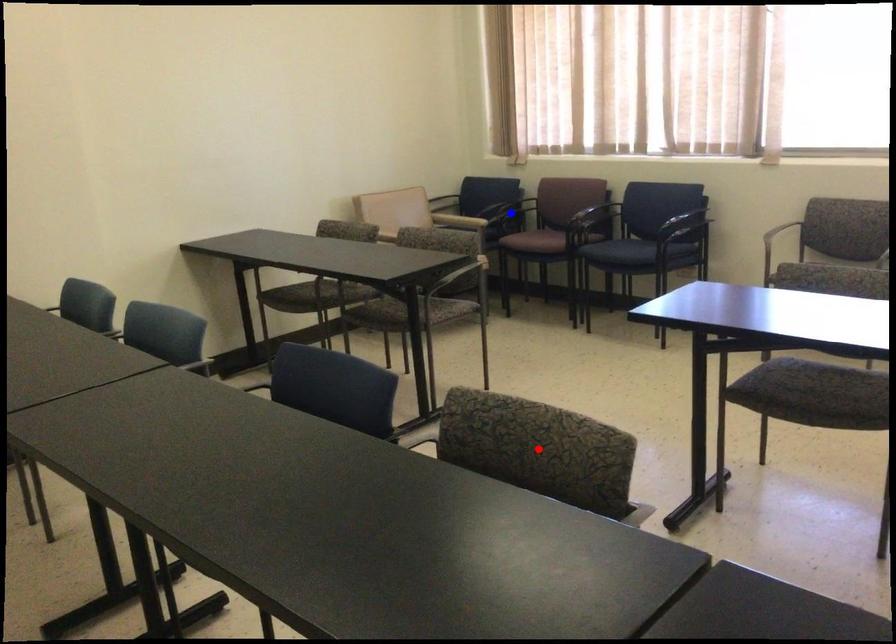
Question: Which of the two points in the image is closer to the camera?

Choices:
 (A) Blue point is closer.
 (B) Red point is closer.

Answer: (B)